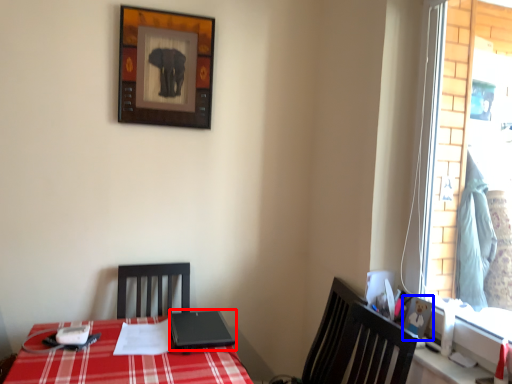
Question: Which object is closer to the camera taking this photo, laptop (highlighted by a red box) or picture frame (highlighted by a blue box)?

Choices:
 (A) laptop
 (B) picture frame

Answer: (B)